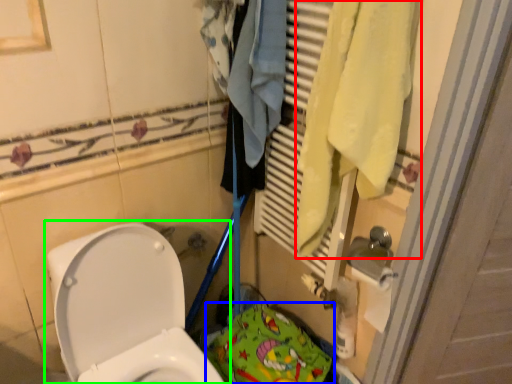
Question: Which object is the closest to the bath towel (highlighted by a red box)? Choose among these: material (highlighted by a blue box) or toilet (highlighted by a green box).

Choices:
 (A) material
 (B) toilet

Answer: (B)